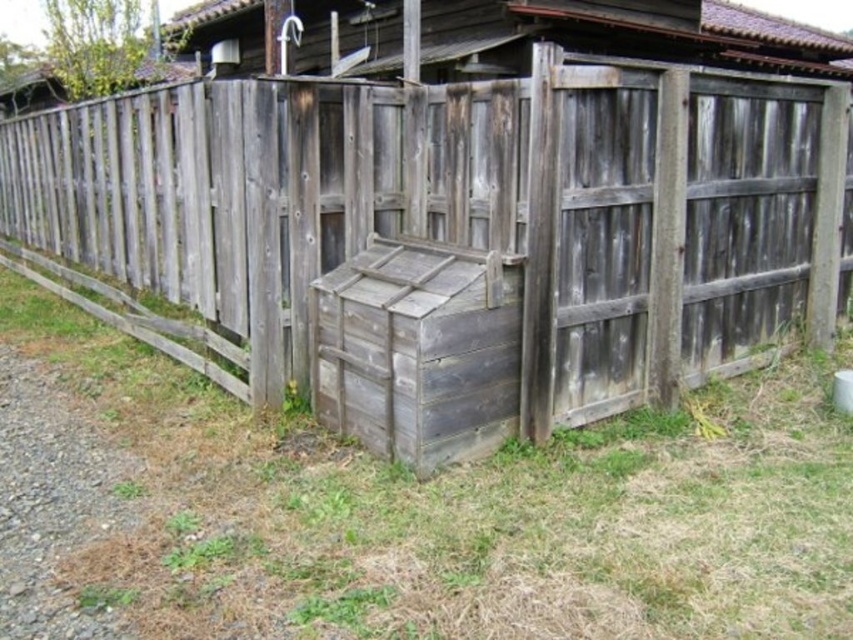
Based on the scene description, can you determine if the weathered wood fence at center is wider than the green grass at lower center?

The weathered wood fence at center is wider than the green grass at lower center according to the description.

You are standing in a rural area and see the green grass at lower center and the weathered wood crate at center. Which object is closer to the ground?

The green grass at lower center is closer to the ground because it is located below the weathered wood crate at center.